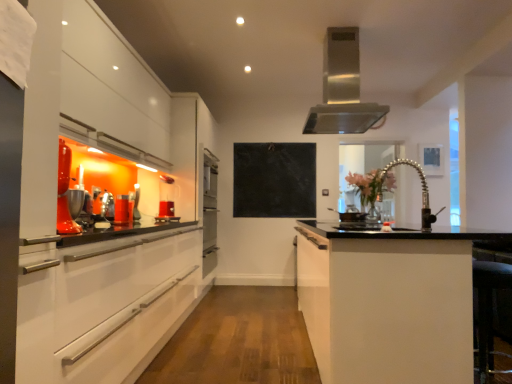
Identify the location of black matte stove at center, placed as the 1th appliance when sorted from right to left. (352, 216).

How much space does white matte cabinet at center, which is the 1th cabinetry in right-to-left order, occupy horizontally?

It is 37.71 inches.

The height and width of the screenshot is (384, 512). Describe the element at coordinates (422, 189) in the screenshot. I see `satin nickel faucet at center` at that location.

Image resolution: width=512 pixels, height=384 pixels. I want to click on satin nickel faucet at center, so click(422, 189).

You are a GUI agent. You are given a task and a screenshot of the screen. Output one action in this format:
    pyautogui.click(x=<x>, y=<y>)
    Task: Click on the white glossy cabinetry at left, arranged as the first cabinetry when viewed from the left
    The image size is (512, 384).
    Given the screenshot: What is the action you would take?
    pyautogui.click(x=104, y=203)

In order to face black marble bulletin board at center, should I rotate leftwards or rightwards?

Turn right approximately 2.427 degrees to face it.

Find the location of a particular element. This screenshot has width=512, height=384. black matte stove at center, placed as the 1th appliance when sorted from right to left is located at coordinates (352, 216).

Consider the image. Measure the distance between black matte stove at center, the 2th appliance viewed from the front, and translucent glass cup at left, arranged as the 2th appliance when viewed from the back.

A distance of 6.46 feet exists between black matte stove at center, the 2th appliance viewed from the front, and translucent glass cup at left, arranged as the 2th appliance when viewed from the back.

Is translucent glass cup at left, the 1th appliance viewed from the left, at the back of black matte stove at center, the 2th appliance viewed from the front?

black matte stove at center, the 2th appliance viewed from the front, does not have its back to translucent glass cup at left, the 1th appliance viewed from the left.

Considering the relative sizes of black matte stove at center, the 2th appliance when ordered from left to right, and translucent glass cup at left, which is the 2th appliance from right to left, in the image provided, is black matte stove at center, the 2th appliance when ordered from left to right, wider than translucent glass cup at left, which is the 2th appliance from right to left,?

Yes, black matte stove at center, the 2th appliance when ordered from left to right, is wider than translucent glass cup at left, which is the 2th appliance from right to left.

Does point (357, 215) lie behind point (115, 211)?

Yes, point (357, 215) is behind point (115, 211).

Is black matte stove at center, arranged as the first appliance when viewed from the back, spatially inside translucent glass vase at center, or outside of it?

black matte stove at center, arranged as the first appliance when viewed from the back, is outside translucent glass vase at center.

Consider the image. Which is nearer, (359, 219) or (389, 145)?

Positioned in front is point (359, 219).

Is black matte stove at center, the 2th appliance when ordered from left to right, not near translucent glass vase at center?

Yes, black matte stove at center, the 2th appliance when ordered from left to right, is far from translucent glass vase at center.

Considering the relative positions of black matte stove at center, the 2th appliance when ordered from left to right, and translucent glass vase at center in the image provided, is black matte stove at center, the 2th appliance when ordered from left to right, behind translucent glass vase at center?

No.

Can you see black marble bulletin board at center touching translucent glass vase at center?

black marble bulletin board at center and translucent glass vase at center are not in contact.

Is black marble bulletin board at center closer to camera compared to translucent glass vase at center?

No, black marble bulletin board at center is further to the viewer.

From the picture: Is black marble bulletin board at center bigger or smaller than translucent glass vase at center?

Clearly, black marble bulletin board at center is smaller in size than translucent glass vase at center.

Is point (307, 154) closer to camera compared to point (385, 146)?

Yes, it is in front of point (385, 146).

Which is correct: translucent glass cup at left, which is the 2th appliance from right to left, is inside satin nickel faucet at center, or outside of it?

translucent glass cup at left, which is the 2th appliance from right to left, is not enclosed by satin nickel faucet at center.

Can you confirm if translucent glass cup at left, arranged as the 2th appliance when viewed from the back, is positioned to the left of satin nickel faucet at center?

Correct, you'll find translucent glass cup at left, arranged as the 2th appliance when viewed from the back, to the left of satin nickel faucet at center.

Consider the image. Which is closer, (131, 201) or (423, 189)?

Point (131, 201).

Can you tell me how much translucent glass cup at left, arranged as the first appliance when viewed from the front, and satin nickel faucet at center differ in facing direction?

The angular difference between translucent glass cup at left, arranged as the first appliance when viewed from the front, and satin nickel faucet at center is 174 degrees.

Considering the sizes of objects translucent glass vase at center and black marble bulletin board at center in the image provided, who is bigger, translucent glass vase at center or black marble bulletin board at center?

With larger size is translucent glass vase at center.

Considering the positions of objects translucent glass vase at center and black marble bulletin board at center in the image provided, who is more to the left, translucent glass vase at center or black marble bulletin board at center?

black marble bulletin board at center.

Is translucent glass vase at center with black marble bulletin board at center?

No, translucent glass vase at center is not next to black marble bulletin board at center.

Locate an element on the screen. bulletin board located above the translucent glass vase at center (from a real-world perspective) is located at coordinates (274, 180).

From the image's perspective, does stainless steel range hood at upper center appear lower than black matte stove at center, placed as the 1th appliance when sorted from right to left?

Actually, stainless steel range hood at upper center appears above black matte stove at center, placed as the 1th appliance when sorted from right to left, in the image.

What's the angular difference between stainless steel range hood at upper center and black matte stove at center, the 2th appliance viewed from the front,'s facing directions?

The angle between the facing direction of stainless steel range hood at upper center and the facing direction of black matte stove at center, the 2th appliance viewed from the front, is 51.7 degrees.

From a real-world perspective, is stainless steel range hood at upper center positioned under black matte stove at center, placed as the 1th appliance when sorted from right to left, based on gravity?

Actually, stainless steel range hood at upper center is physically above black matte stove at center, placed as the 1th appliance when sorted from right to left, in the real world.

In terms of width, does stainless steel range hood at upper center look wider or thinner when compared to black matte stove at center, arranged as the first appliance when viewed from the back?

Clearly, stainless steel range hood at upper center has more width compared to black matte stove at center, arranged as the first appliance when viewed from the back.

Can you confirm if stainless steel range hood at upper center is positioned to the left of white glossy cabinetry at left, which ranks as the second cabinetry in right-to-left order?

No.

Is stainless steel range hood at upper center shorter than white glossy cabinetry at left, which ranks as the second cabinetry in right-to-left order?

Yes.

Looking at this image, from the image's perspective, which one is positioned lower, stainless steel range hood at upper center or white glossy cabinetry at left, arranged as the first cabinetry when viewed from the left?

white glossy cabinetry at left, arranged as the first cabinetry when viewed from the left.

Which object is thinner, stainless steel range hood at upper center or white glossy cabinetry at left, arranged as the first cabinetry when viewed from the left?

white glossy cabinetry at left, arranged as the first cabinetry when viewed from the left.

At what (x,y) coordinates should I click in order to perform the action: click on appliance in front of the black matte stove at center, the 2th appliance viewed from the front. Please return your answer as a coordinate pair (x, y). Looking at the image, I should click on (124, 209).

You are a GUI agent. You are given a task and a screenshot of the screen. Output one action in this format:
    pyautogui.click(x=<x>, y=<y>)
    Task: Click on the window screen on the right of black matte stove at center, arranged as the first appliance when viewed from the back
    The height and width of the screenshot is (384, 512).
    Given the screenshot: What is the action you would take?
    pyautogui.click(x=360, y=169)

Based on their spatial positions, is black matte stove at center, the 2th appliance when ordered from left to right, or satin nickel faucet at center closer to black marble bulletin board at center?

black matte stove at center, the 2th appliance when ordered from left to right, is closer to black marble bulletin board at center.

Estimate the real-world distances between objects in this image. Which object is closer to translucent glass cup at left, arranged as the 2th appliance when viewed from the back, black marble bulletin board at center or stainless steel range hood at upper center?

The object closer to translucent glass cup at left, arranged as the 2th appliance when viewed from the back, is stainless steel range hood at upper center.

Considering their positions, is translucent glass cup at left, the 1th appliance viewed from the left, positioned closer to white matte cabinet at center, which is the 1th cabinetry in right-to-left order, than translucent glass vase at center?

translucent glass cup at left, the 1th appliance viewed from the left.

Consider the image. Based on their spatial positions, is black matte stove at center, the 2th appliance viewed from the front, or translucent glass cup at left, arranged as the 2th appliance when viewed from the back, further from black marble bulletin board at center?

translucent glass cup at left, arranged as the 2th appliance when viewed from the back, is further to black marble bulletin board at center.

From the image, which object appears to be nearer to white matte cabinet at center, the second cabinetry from the left, translucent glass vase at center or satin nickel faucet at center?

Result: Based on the image, satin nickel faucet at center appears to be nearer to white matte cabinet at center, the second cabinetry from the left.

When comparing their distances from black marble bulletin board at center, does white glossy cabinetry at left, which ranks as the second cabinetry in right-to-left order, or translucent glass vase at center seem closer?

The object closer to black marble bulletin board at center is translucent glass vase at center.

Estimate the real-world distances between objects in this image. Which object is closer to white glossy cabinetry at left, arranged as the first cabinetry when viewed from the left, black matte stove at center, the 2th appliance when ordered from left to right, or translucent glass vase at center?

Among the two, black matte stove at center, the 2th appliance when ordered from left to right, is located nearer to white glossy cabinetry at left, arranged as the first cabinetry when viewed from the left.

When comparing their distances from satin nickel faucet at center, does stainless steel range hood at upper center or translucent glass vase at center seem closer?

stainless steel range hood at upper center is positioned closer to the anchor satin nickel faucet at center.

At what (x,y) coordinates should I click in order to perform the action: click on cabinetry between white glossy cabinetry at left, which ranks as the second cabinetry in right-to-left order, and stainless steel range hood at upper center in the front-back direction. Please return your answer as a coordinate pair (x, y). The height and width of the screenshot is (384, 512). Looking at the image, I should click on (388, 302).

Find the location of a particular element. The width and height of the screenshot is (512, 384). home appliance between translucent glass cup at left, which is the 2th appliance from right to left, and black marble bulletin board at center in the front-back direction is located at coordinates (342, 89).

Find the location of `home appliance between translucent glass cup at left, arranged as the 2th appliance when viewed from the back, and translucent glass vase at center`. home appliance between translucent glass cup at left, arranged as the 2th appliance when viewed from the back, and translucent glass vase at center is located at coordinates (342, 89).

This screenshot has height=384, width=512. I want to click on sink between stainless steel range hood at upper center and white matte cabinet at center, which is the 1th cabinetry in right-to-left order, in the up-down direction, so click(x=422, y=189).